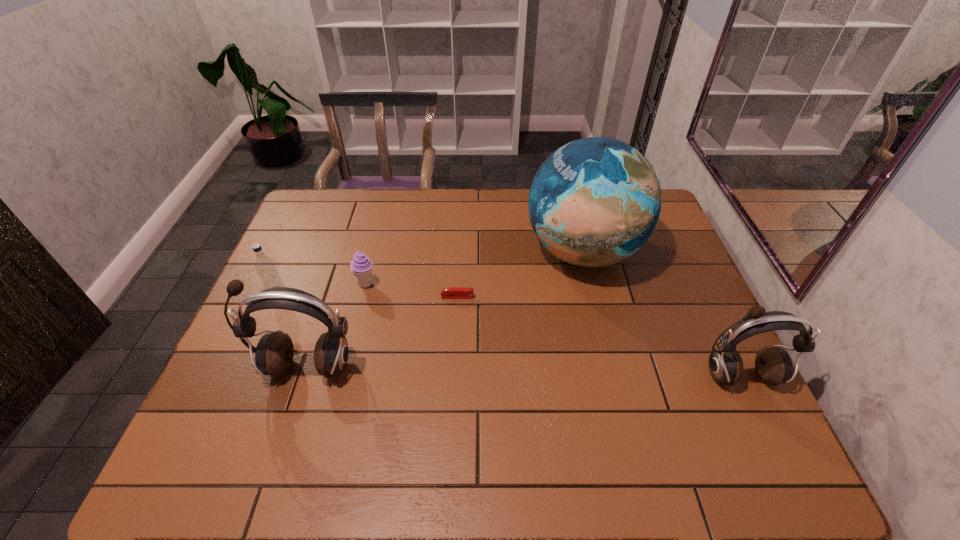
At what (x,y) coordinates should I click in order to perform the action: click on the taller earphone. Please return your answer as a coordinate pair (x, y). The image size is (960, 540). Looking at the image, I should click on (274, 353).

Locate an element on the screen. The width and height of the screenshot is (960, 540). the left earphone is located at coordinates (274, 353).

Image resolution: width=960 pixels, height=540 pixels. I want to click on the fourth shortest object, so click(774, 366).

In order to click on the right earphone in this screenshot , I will do `click(774, 366)`.

The width and height of the screenshot is (960, 540). In order to click on the second object from right to left in this screenshot , I will do `click(595, 201)`.

Image resolution: width=960 pixels, height=540 pixels. What are the coordinates of `globe` in the screenshot? It's located at (595, 201).

Locate an element on the screen. The height and width of the screenshot is (540, 960). the fifth tallest object is located at coordinates [x=361, y=266].

Locate an element on the screen. The height and width of the screenshot is (540, 960). the fourth tallest object is located at coordinates (x=265, y=266).

What are the coordinates of `the fourth object from left to right` in the screenshot? It's located at (452, 292).

I want to click on the shortest object, so click(452, 292).